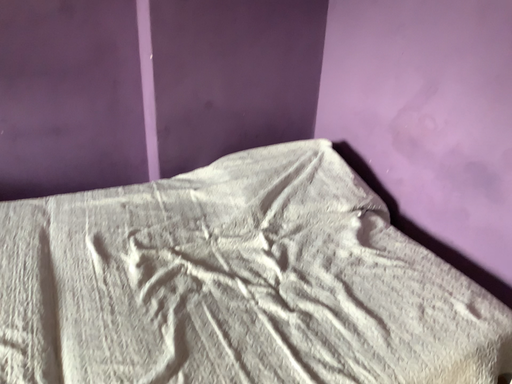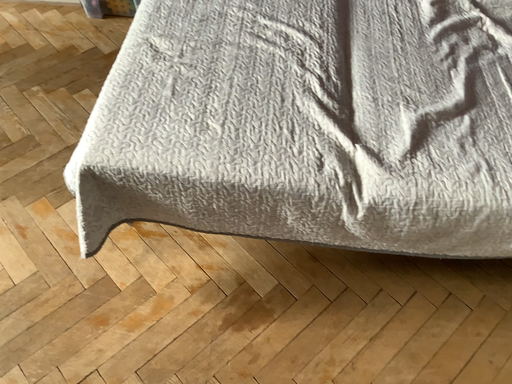
Question: How did the camera likely rotate when shooting the video?

Choices:
 (A) rotated left
 (B) rotated right

Answer: (A)